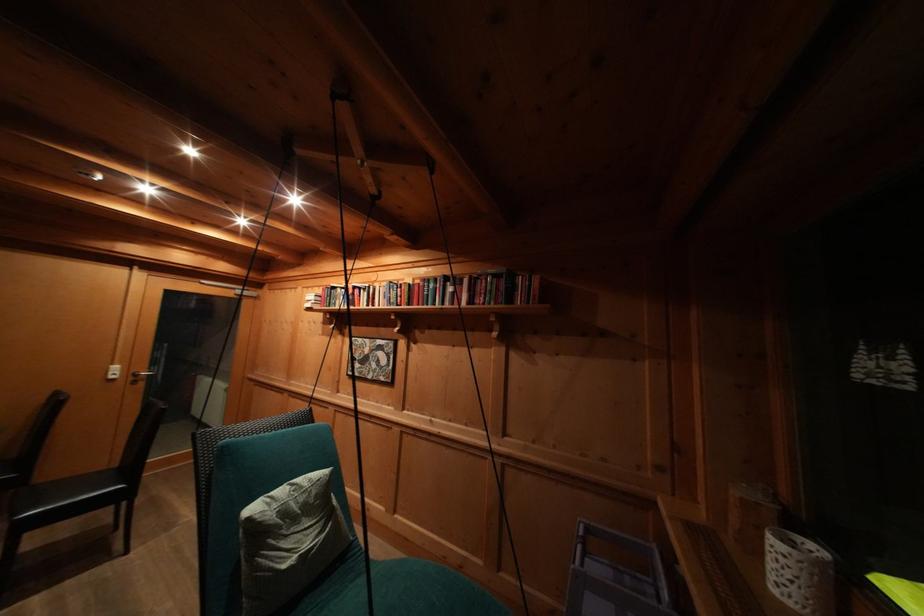
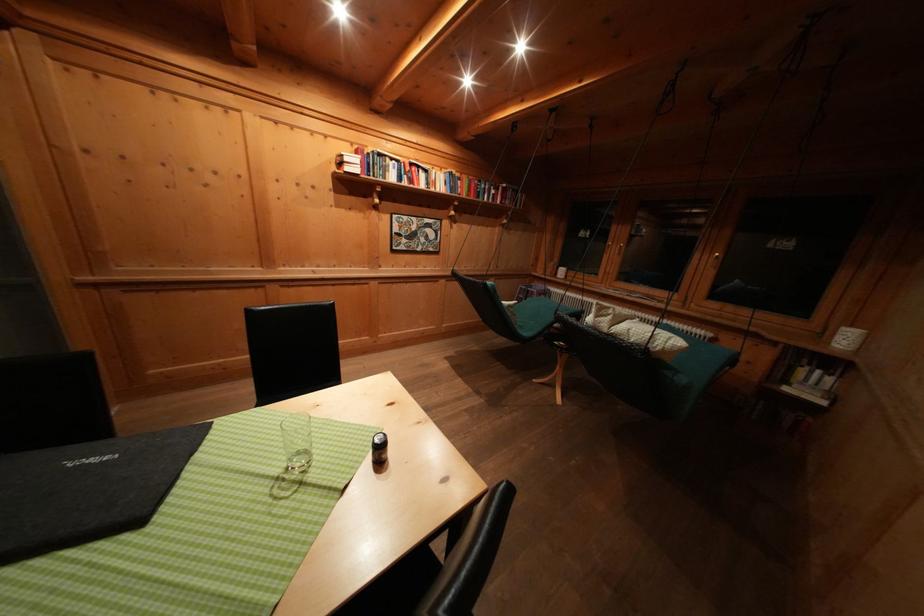
Question: I am providing you with two images of the same scene from different viewpoints. Which of the following objects are not visible in image2?

Choices:
 (A) chair sitting surface
 (B) hanging chair sitting surface
 (C) folded white cloth
 (D) white pillow

Answer: (A)